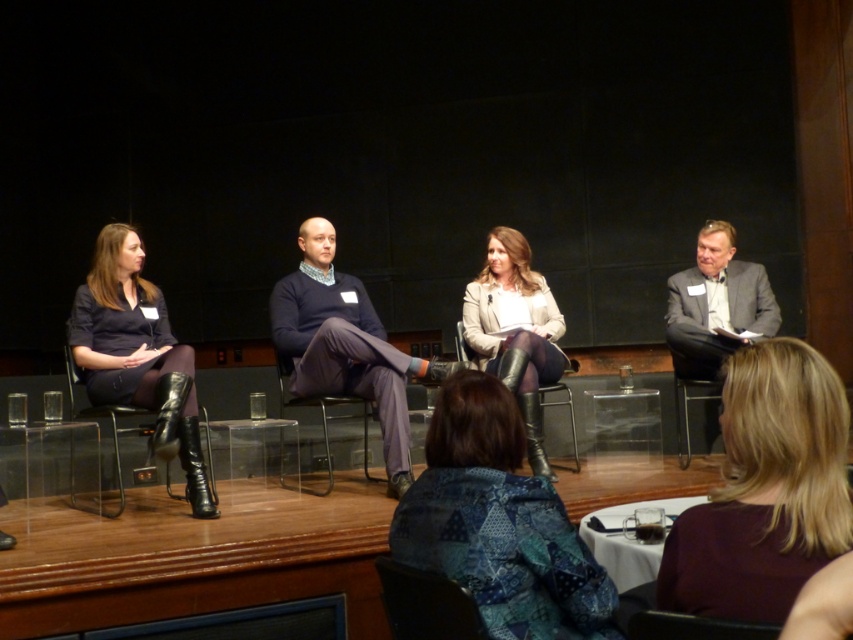
You are organizing a small workshop and need to seat two people comfortably. You have a matte black chair at lower center and a black leather chair at lower center available. Which chair would allow for more space between the two people if placed side by side?

The matte black chair at lower center has a larger width than the black leather chair at lower center, so placing them side by side would provide more space between the two people when using the matte black chair at lower center.

You are standing 2 meters away from the stage. Can you reach the point at coordinates point [392,572] on the stage if you stretch your arm forward?

The point at coordinates point [392,572] is 1.87 meters away from the viewer. Since you are standing 2 meters away from the stage, stretching your arm forward would allow you to reach it as the distance is slightly shorter than your position.

You are standing at the point labeled point (756, 560). If you want to take a photo of the panel discussion stage, which is 4.09 feet away from you, will you be able to capture the entire stage in your camera frame?

The distance between you and the stage is 4.09 feet. Since the camera can typically capture a wide enough angle to include the entire stage at this distance, you should be able to capture the entire stage in your camera frame.